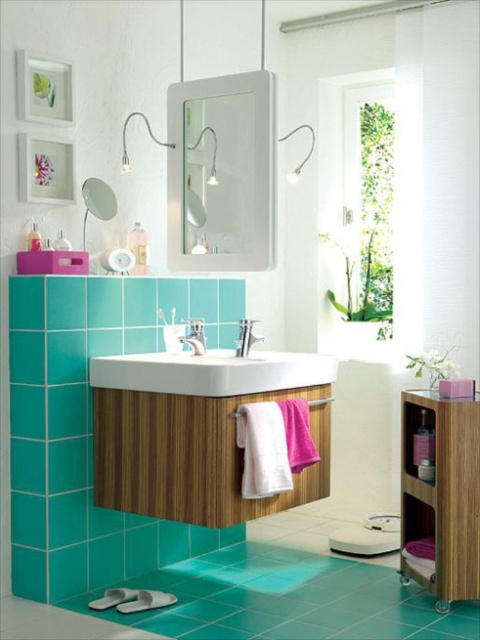
Does white glossy sink at center have a greater width compared to satin nickel faucet at center?

Yes, white glossy sink at center is wider than satin nickel faucet at center.

Who is more forward, (x=118, y=356) or (x=192, y=332)?

Point (x=118, y=356) is more forward.

Who is more forward, (333, 376) or (192, 330)?

Point (333, 376) is more forward.

Identify the location of white glossy sink at center. The width and height of the screenshot is (480, 640). (212, 372).

This screenshot has height=640, width=480. What do you see at coordinates (222, 172) in the screenshot?
I see `white glossy mirror at upper center` at bounding box center [222, 172].

How much distance is there between white glossy mirror at upper center and wooden cabinet at lower right?

4.16 feet

At what (x,y) coordinates should I click in order to perform the action: click on white glossy mirror at upper center. Please return your answer as a coordinate pair (x, y). The height and width of the screenshot is (640, 480). Looking at the image, I should click on (222, 172).

Who is shorter, wooden cabinet at lower right or satin nickel faucet at center?

satin nickel faucet at center is shorter.

Does wooden cabinet at lower right appear on the right side of satin nickel faucet at center?

Indeed, wooden cabinet at lower right is positioned on the right side of satin nickel faucet at center.

The height and width of the screenshot is (640, 480). Identify the location of wooden cabinet at lower right. (440, 493).

The height and width of the screenshot is (640, 480). I want to click on wooden cabinet at lower right, so click(440, 493).